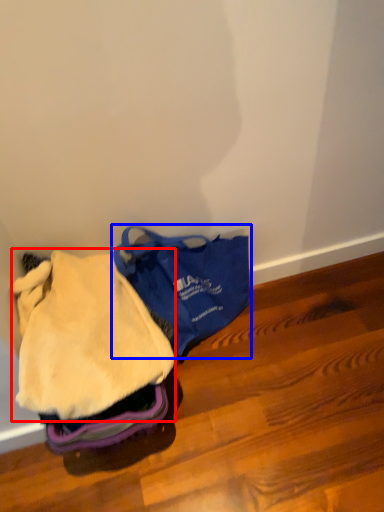
Question: Among these objects, which one is nearest to the camera, clothing (highlighted by a red box) or luggage and bags (highlighted by a blue box)?

Choices:
 (A) clothing
 (B) luggage and bags

Answer: (A)